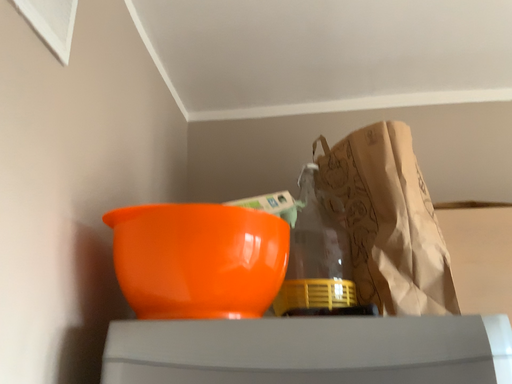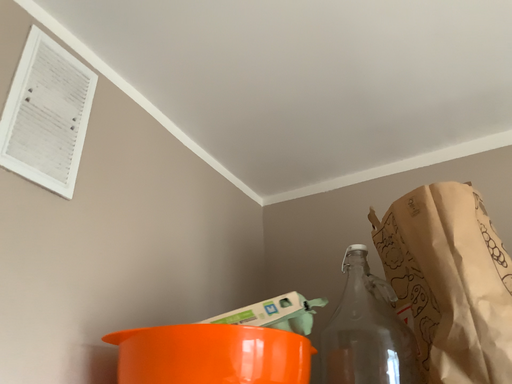
Question: Which way did the camera rotate in the video?

Choices:
 (A) rotated downward
 (B) rotated upward

Answer: (B)